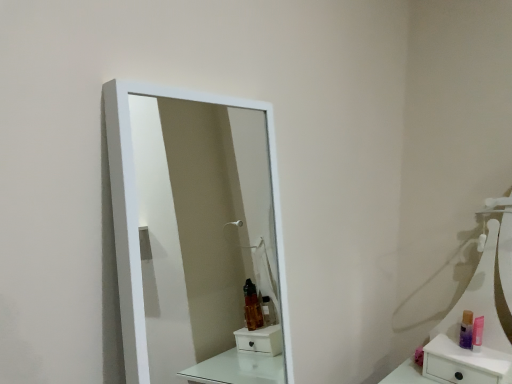
This screenshot has width=512, height=384. Describe the element at coordinates (466, 330) in the screenshot. I see `purple glossy bottle at right` at that location.

What is the approximate width of purple glossy bottle at right?

purple glossy bottle at right is 2.76 inches in width.

Identify the location of purple glossy bottle at right. (466, 330).

At what (x,y) coordinates should I click in order to perform the action: click on purple glossy bottle at right. Please return your answer as a coordinate pair (x, y). The height and width of the screenshot is (384, 512). Looking at the image, I should click on (466, 330).